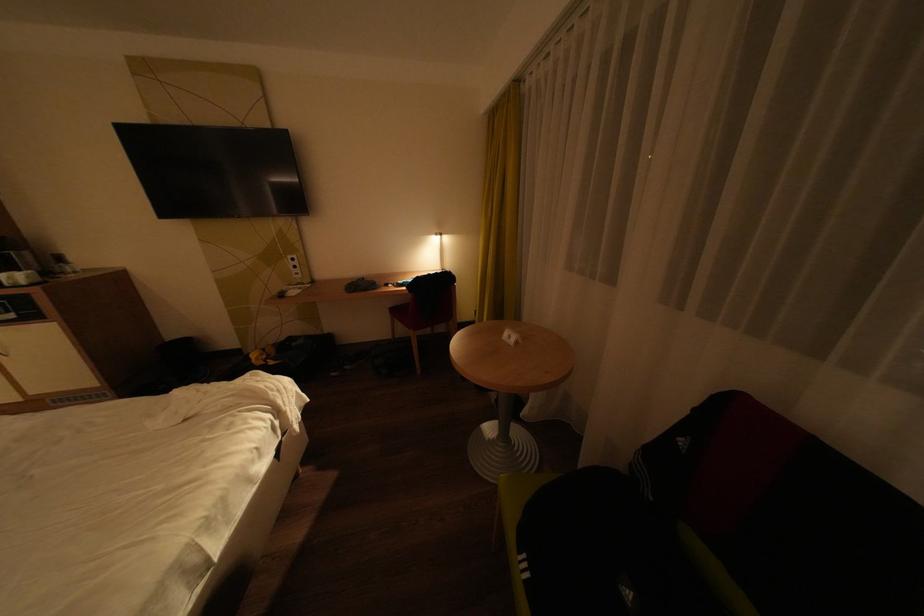
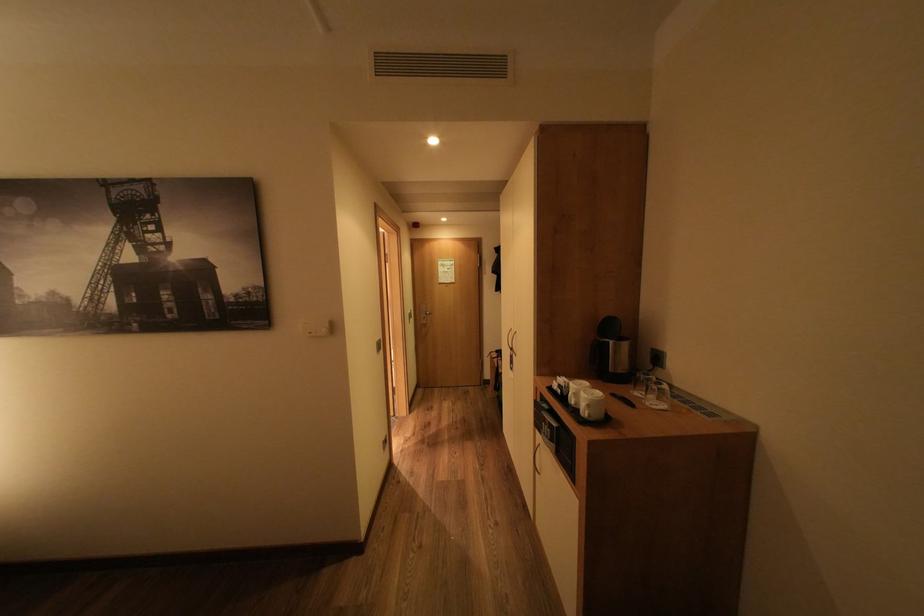
Find the pixel in the second image that matches (x=38, y=277) in the first image.

(600, 406)